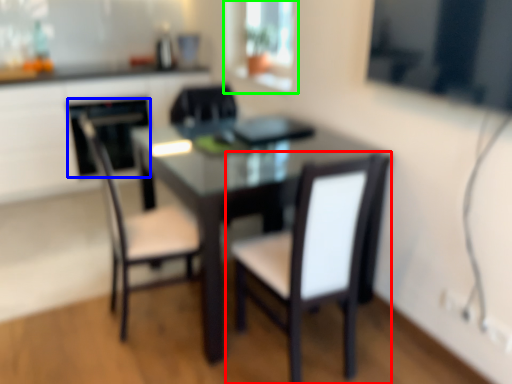
Question: Which object is positioned farthest from chair (highlighted by a red box)? Select from appliance (highlighted by a blue box) and window screen (highlighted by a green box).

Choices:
 (A) appliance
 (B) window screen

Answer: (A)